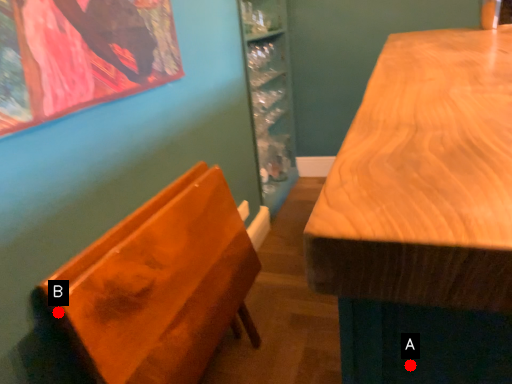
Question: Two points are circled on the image, labeled by A and B beside each circle. Among these points, which one is farthest from the camera?

Choices:
 (A) A is further
 (B) B is further

Answer: (B)